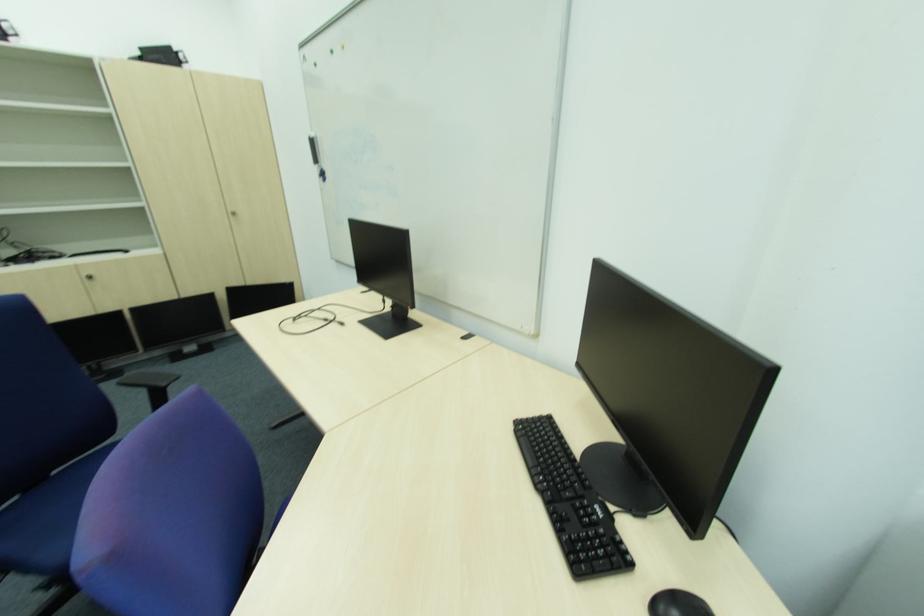
The width and height of the screenshot is (924, 616). Describe the element at coordinates (148, 379) in the screenshot. I see `a black chair armrest` at that location.